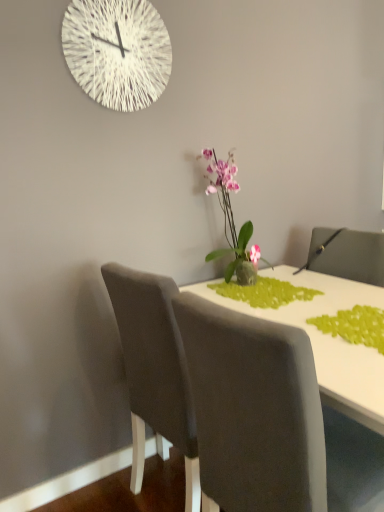
Find the location of a particular element. The image size is (384, 512). free space in front of green matte plant at center, which appears as the 1th plant when viewed from the back is located at coordinates (321, 318).